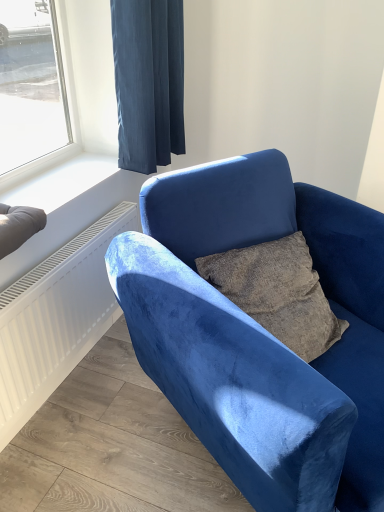
Question: Relative to velvet blue chair at center, is white smooth window sill at upper left in front or behind?

Choices:
 (A) front
 (B) behind

Answer: (B)

Question: Is white smooth window sill at upper left inside the boundaries of velvet blue chair at center, or outside?

Choices:
 (A) inside
 (B) outside

Answer: (B)

Question: Which object is positioned closest to the velvet blue chair at center?

Choices:
 (A) dark blue velvet curtain at upper center
 (B) white smooth window sill at upper left

Answer: (B)

Question: Estimate the real-world distances between objects in this image. Which object is farther from the velvet blue chair at center?

Choices:
 (A) white smooth window sill at upper left
 (B) dark blue velvet curtain at upper center

Answer: (B)